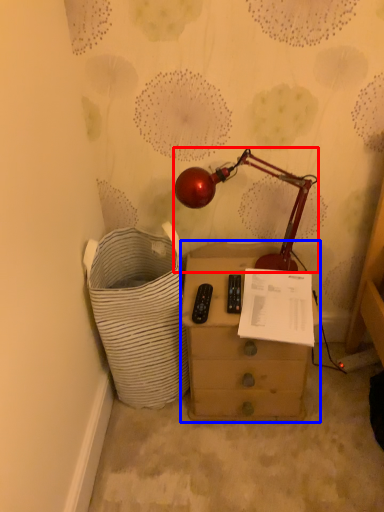
Question: Which object is further to the camera taking this photo, lamp (highlighted by a red box) or chest of drawers (highlighted by a blue box)?

Choices:
 (A) lamp
 (B) chest of drawers

Answer: (B)